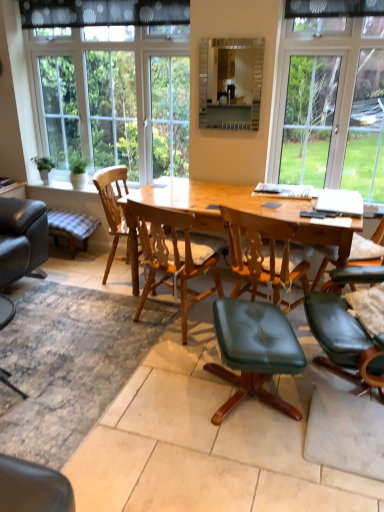
Image resolution: width=384 pixels, height=512 pixels. What are the coordinates of `free space in front of black plastic remote control at center` in the screenshot? It's located at pyautogui.click(x=316, y=218).